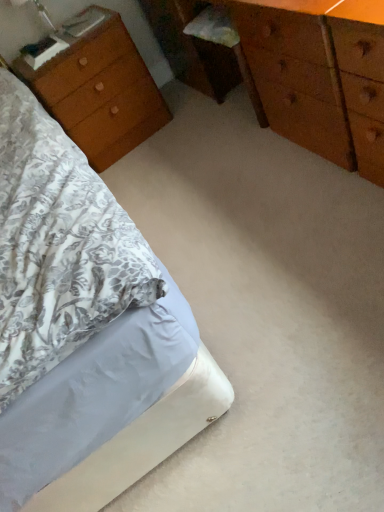
Question: Is wooden chest of drawers at center behind white fabric bed at lower left?

Choices:
 (A) no
 (B) yes

Answer: (B)

Question: From a real-world perspective, is wooden chest of drawers at center located beneath white fabric bed at lower left?

Choices:
 (A) yes
 (B) no

Answer: (B)

Question: From the image's perspective, does wooden chest of drawers at center appear lower than white fabric bed at lower left?

Choices:
 (A) yes
 (B) no

Answer: (B)

Question: Does wooden chest of drawers at center have a greater height compared to white fabric bed at lower left?

Choices:
 (A) yes
 (B) no

Answer: (A)

Question: Is wooden chest of drawers at center facing towards white fabric bed at lower left?

Choices:
 (A) yes
 (B) no

Answer: (A)

Question: From a real-world perspective, is wooden nightstand at left positioned above or below wooden chest of drawers at center?

Choices:
 (A) below
 (B) above

Answer: (A)

Question: Considering the positions of wooden nightstand at left and wooden chest of drawers at center in the image, is wooden nightstand at left taller or shorter than wooden chest of drawers at center?

Choices:
 (A) tall
 (B) short

Answer: (B)

Question: From the image's perspective, is wooden nightstand at left positioned above or below wooden chest of drawers at center?

Choices:
 (A) below
 (B) above

Answer: (A)

Question: Relative to wooden chest of drawers at center, is wooden nightstand at left in front or behind?

Choices:
 (A) front
 (B) behind

Answer: (B)

Question: Considering the positions of wooden chest of drawers at center and white fabric bed at lower left in the image, is wooden chest of drawers at center bigger or smaller than white fabric bed at lower left?

Choices:
 (A) small
 (B) big

Answer: (B)

Question: In the image, is wooden chest of drawers at center positioned in front of or behind white fabric bed at lower left?

Choices:
 (A) behind
 (B) front

Answer: (A)

Question: Would you say wooden chest of drawers at center is inside or outside white fabric bed at lower left?

Choices:
 (A) outside
 (B) inside

Answer: (A)

Question: From a real-world perspective, relative to white fabric bed at lower left, is wooden chest of drawers at center vertically above or below?

Choices:
 (A) below
 (B) above

Answer: (B)

Question: Is point (99, 151) closer or farther from the camera than point (41, 266)?

Choices:
 (A) farther
 (B) closer

Answer: (A)

Question: Considering the positions of wooden nightstand at left and white fabric bed at lower left in the image, is wooden nightstand at left wider or thinner than white fabric bed at lower left?

Choices:
 (A) wide
 (B) thin

Answer: (B)